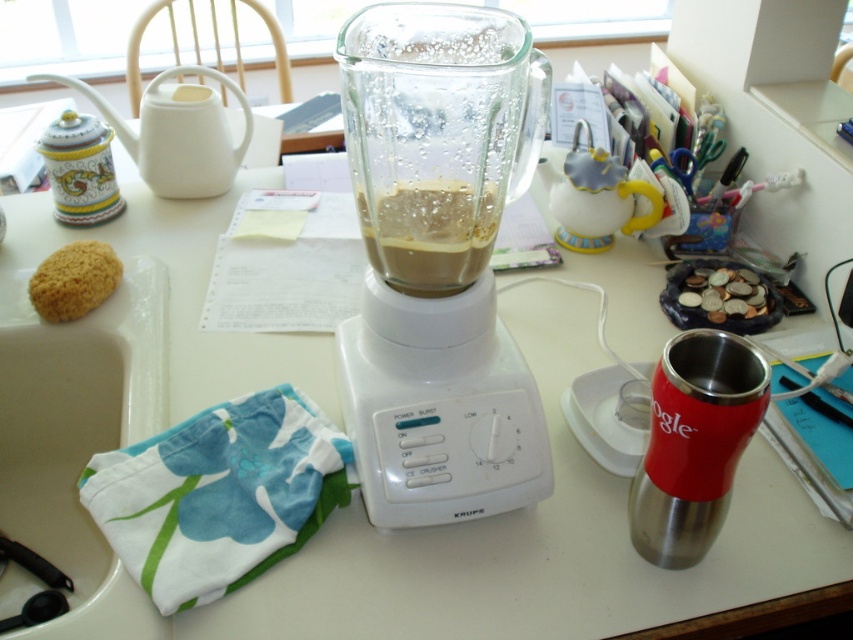
Question: Can you confirm if white plastic blender at center is thinner than yellow sponge at left?

Choices:
 (A) yes
 (B) no

Answer: (B)

Question: Which point is closer to the camera?

Choices:
 (A) brown matte liquid at center
 (B) white plastic blender at center

Answer: (B)

Question: Which point appears farthest from the camera in this image?

Choices:
 (A) [x=68, y=292]
 (B) [x=421, y=228]

Answer: (A)

Question: Is white plastic blender at center closer to camera compared to stainless steel thermos at right?

Choices:
 (A) no
 (B) yes

Answer: (B)

Question: Can you confirm if brown matte liquid at center is wider than yellow sponge at left?

Choices:
 (A) no
 (B) yes

Answer: (B)

Question: Among these objects, which one is nearest to the camera?

Choices:
 (A) yellow sponge at left
 (B) white plastic blender at center
 (C) brown matte liquid at center

Answer: (B)